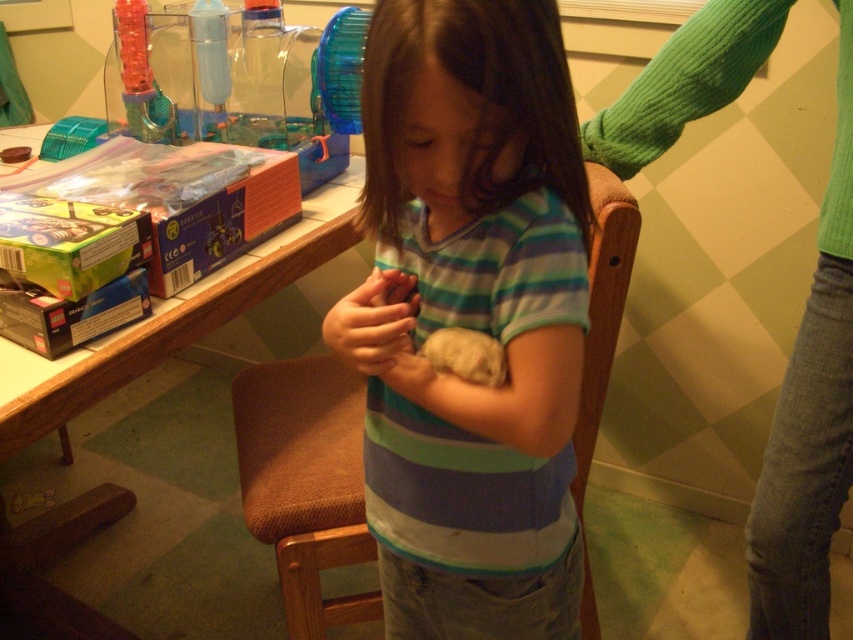
Question: Is striped cotton shirt at center closer to the viewer compared to wooden table at upper left?

Choices:
 (A) yes
 (B) no

Answer: (A)

Question: Which point is farther to the camera?

Choices:
 (A) striped cotton shirt at center
 (B) fuzzy beige hamster at upper center

Answer: (B)

Question: Can you confirm if striped cotton shirt at center is thinner than fuzzy beige hamster at upper center?

Choices:
 (A) no
 (B) yes

Answer: (A)

Question: Which is nearer to the striped cotton shirt at center?

Choices:
 (A) fuzzy beige hamster at upper center
 (B) wooden table at upper left

Answer: (A)

Question: Which object is farther from the camera taking this photo?

Choices:
 (A) striped cotton shirt at center
 (B) fuzzy beige hamster at upper center
 (C) wooden table at upper left

Answer: (C)

Question: In this image, where is striped cotton shirt at center located relative to wooden table at upper left?

Choices:
 (A) left
 (B) right

Answer: (B)